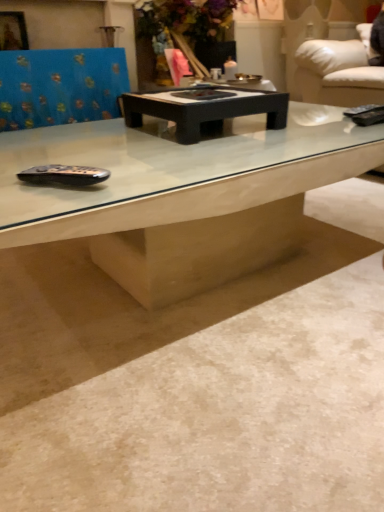
Question: Would you say black matte coffee table at center is inside or outside white marble concrete at center?

Choices:
 (A) inside
 (B) outside

Answer: (B)

Question: Based on their positions, is black matte coffee table at center located to the left or right of white marble concrete at center?

Choices:
 (A) left
 (B) right

Answer: (A)

Question: Based on their relative distances, which object is nearer to the white marble concrete at center?

Choices:
 (A) blue fabric swivel chair at upper left
 (B) black matte coffee table at center

Answer: (B)

Question: Which object is the farthest from the black matte coffee table at center?

Choices:
 (A) white marble concrete at center
 (B) blue fabric swivel chair at upper left

Answer: (B)